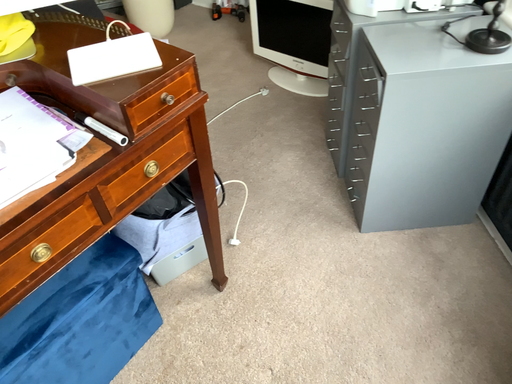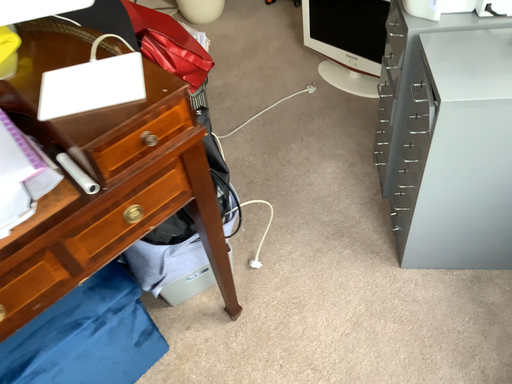
Question: Which way did the camera rotate in the video?

Choices:
 (A) rotated left
 (B) rotated right

Answer: (A)